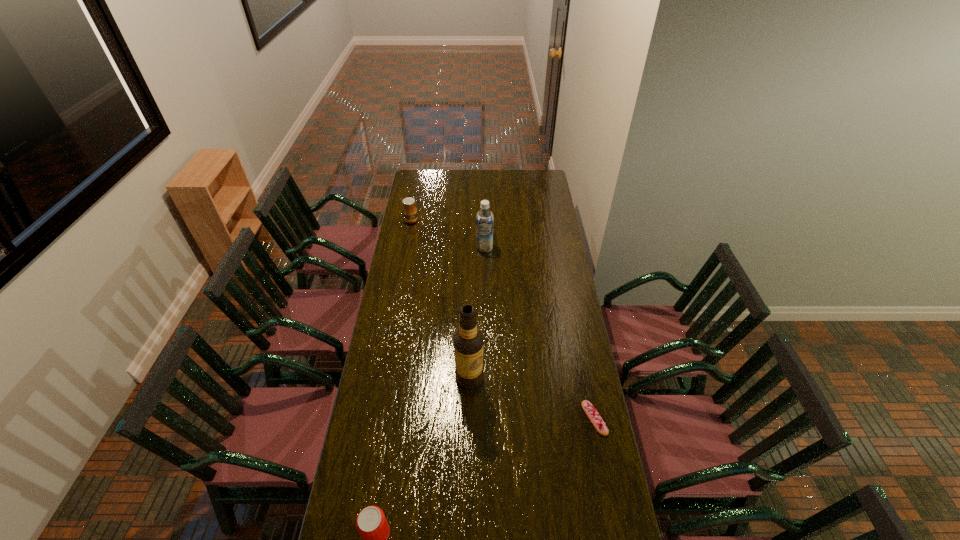
The image size is (960, 540). I want to click on object that stands as the fourth closest to the tallest object, so click(x=409, y=210).

You are a GUI agent. You are given a task and a screenshot of the screen. Output one action in this format:
    pyautogui.click(x=<x>, y=<y>)
    Task: Click on the second closest object to the soya milk
    
    Given the screenshot: What is the action you would take?
    pyautogui.click(x=468, y=341)

Find the location of `vacant space that satisfies the following two spatial constraints: 1. on the front side of the eclair; 2. on the right side of the farthest object`. vacant space that satisfies the following two spatial constraints: 1. on the front side of the eclair; 2. on the right side of the farthest object is located at coordinates (374, 418).

You are a GUI agent. You are given a task and a screenshot of the screen. Output one action in this format:
    pyautogui.click(x=<x>, y=<y>)
    Task: Click on the free location that satisfies the following two spatial constraints: 1. on the back side of the alcohol; 2. on the left side of the second farthest object
    The height and width of the screenshot is (540, 960).
    Given the screenshot: What is the action you would take?
    pyautogui.click(x=472, y=248)